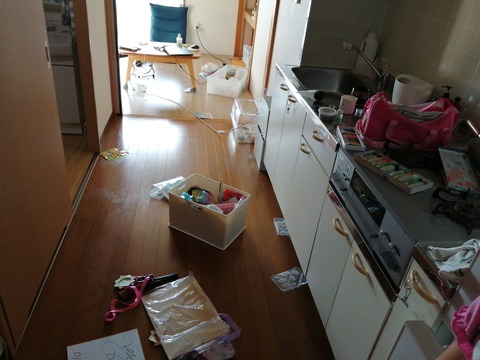
You are a GUI agent. You are given a task and a screenshot of the screen. Output one action in this format:
    pyautogui.click(x=<x>, y=<y>)
    Task: Click on the faucet
    The image size is (480, 360).
    Given the screenshot: What is the action you would take?
    pyautogui.click(x=362, y=62)